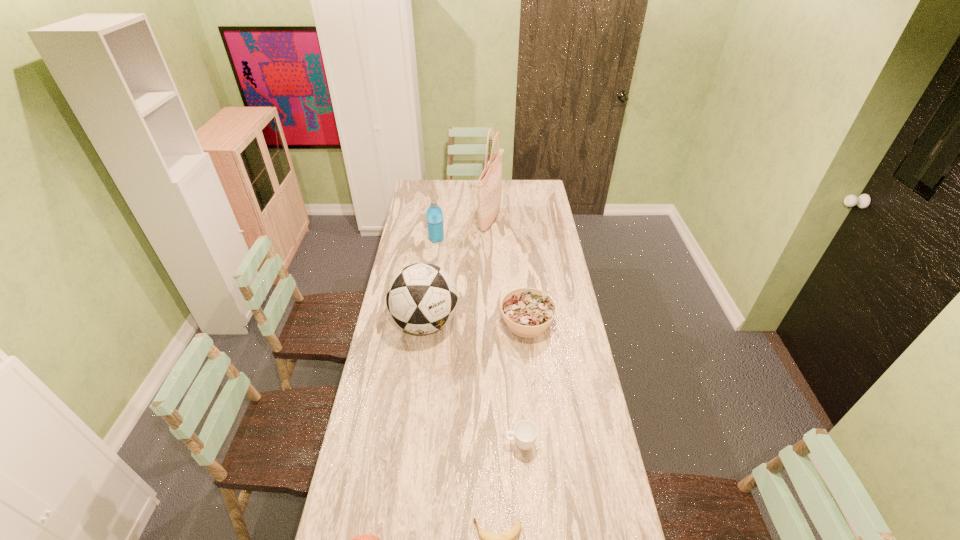
Find the location of a particular element. The image size is (960, 540). blank space located on the surface of the soccer ball where the brand logo is visible is located at coordinates (420, 365).

You are a GUI agent. You are given a task and a screenshot of the screen. Output one action in this format:
    pyautogui.click(x=<x>, y=<y>)
    Task: Click on the vacant space located 0.100m on the back of the fifth shortest object
    Image resolution: width=960 pixels, height=540 pixels.
    Given the screenshot: What is the action you would take?
    pyautogui.click(x=439, y=224)

This screenshot has width=960, height=540. I want to click on free spot located 0.200m on the left of the fourth shortest object, so click(x=454, y=322).

Image resolution: width=960 pixels, height=540 pixels. What are the coordinates of `vacant position located with the handle on the side of the cup` in the screenshot? It's located at (412, 444).

Image resolution: width=960 pixels, height=540 pixels. I want to click on vacant space situated with the handle on the side of the cup, so click(406, 444).

Locate an element on the screen. The width and height of the screenshot is (960, 540). free region located with the handle on the side of the cup is located at coordinates (433, 444).

At what (x,y) coordinates should I click in order to perform the action: click on object present at the far edge. Please return your answer as a coordinate pair (x, y). This screenshot has width=960, height=540. Looking at the image, I should click on (490, 140).

This screenshot has width=960, height=540. Find the location of `soccer ball that is at the left edge`. soccer ball that is at the left edge is located at coordinates (422, 298).

The width and height of the screenshot is (960, 540). What are the coordinates of `thermos bottle at the left edge` in the screenshot? It's located at (434, 213).

The width and height of the screenshot is (960, 540). I want to click on object located in the right edge section of the desktop, so click(x=528, y=312).